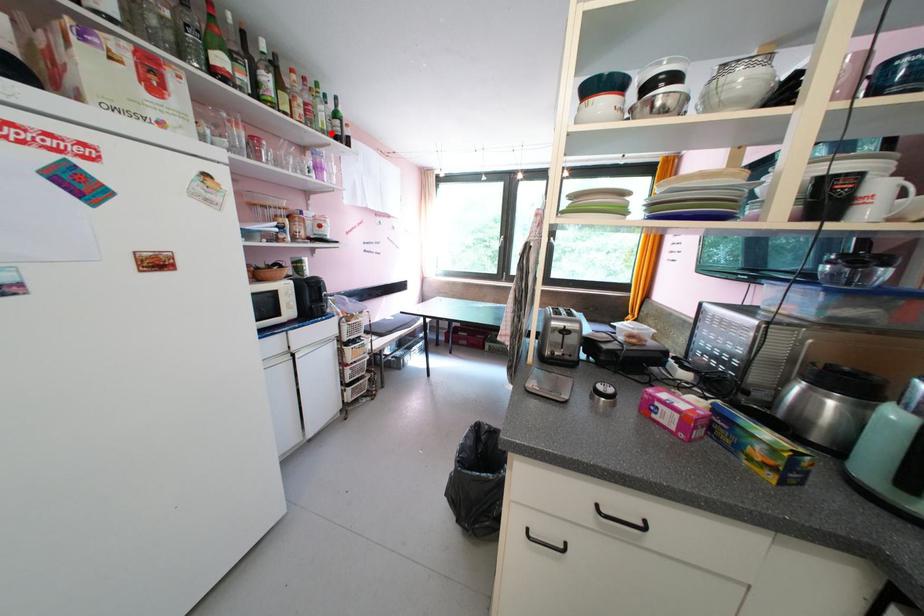
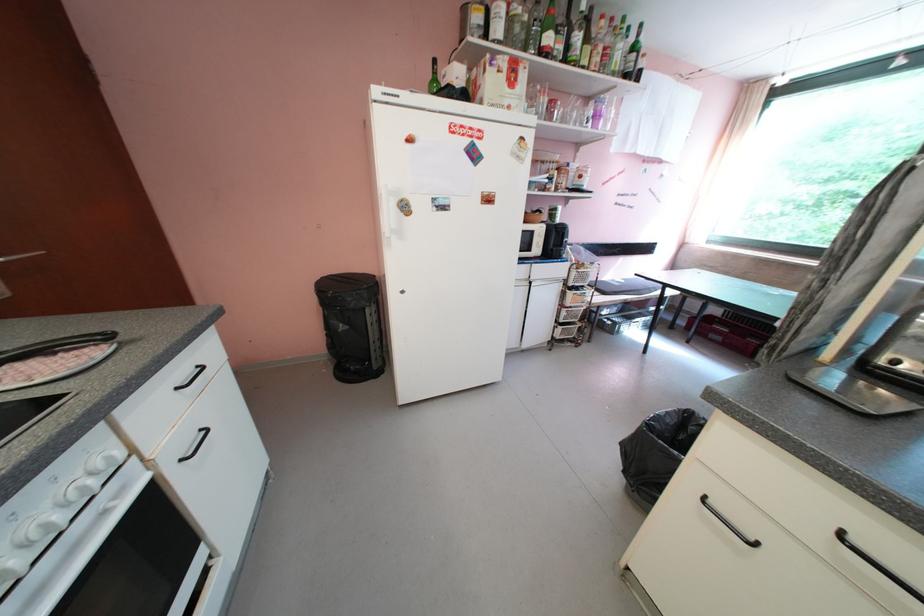
Where in the second image is the point corresponding to the highlighted location from the first image?

(622, 75)